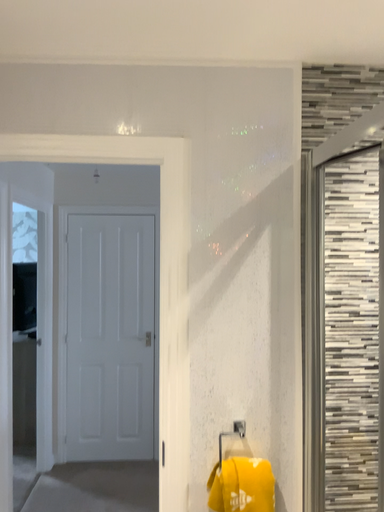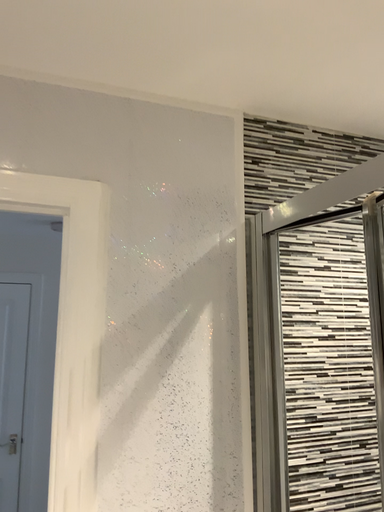
Question: How did the camera likely rotate when shooting the video?

Choices:
 (A) rotated downward
 (B) rotated upward

Answer: (B)